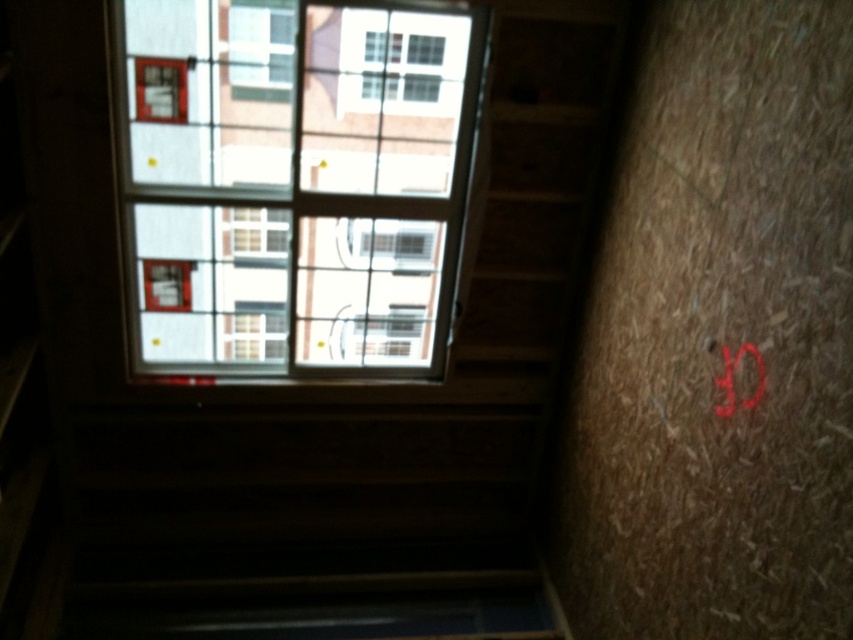
Question: Is transparent glass window at upper center above red matte lettering at upper right?

Choices:
 (A) no
 (B) yes

Answer: (B)

Question: Which of the following is the closest to the observer?

Choices:
 (A) (389, 77)
 (B) (140, 493)

Answer: (A)

Question: Does transparent glass window at upper center have a lesser width compared to clear glass window at upper center?

Choices:
 (A) yes
 (B) no

Answer: (B)

Question: Considering the relative positions of transparent glass window at upper center and clear glass window at upper center in the image provided, where is transparent glass window at upper center located with respect to clear glass window at upper center?

Choices:
 (A) left
 (B) right

Answer: (B)

Question: Which point is closer to the camera taking this photo?

Choices:
 (A) (732, 387)
 (B) (209, 212)

Answer: (A)

Question: Among these objects, which one is nearest to the camera?

Choices:
 (A) red matte lettering at upper right
 (B) transparent glass window at upper center

Answer: (A)